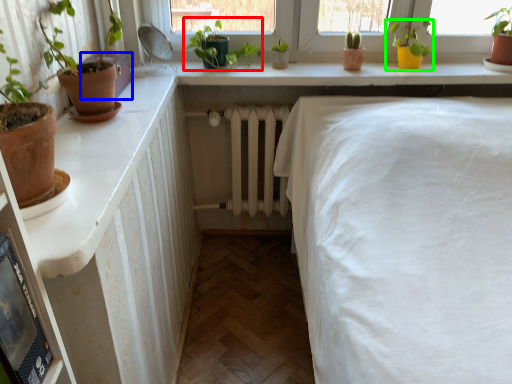
Question: Which is nearer to the houseplant (highlighted by a red box)? window box (highlighted by a blue box) or houseplant (highlighted by a green box).

Choices:
 (A) window box
 (B) houseplant

Answer: (A)